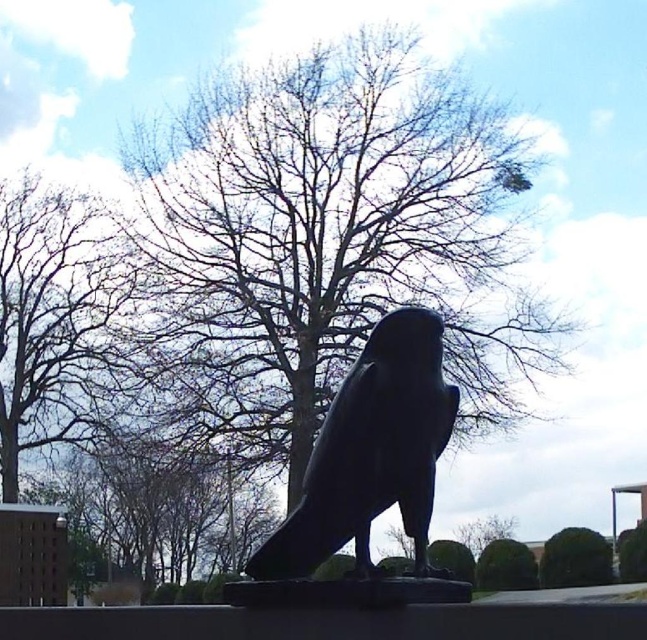
Does bare branches at center have a greater width compared to bare branches at upper left?

Indeed, bare branches at center has a greater width compared to bare branches at upper left.

Where is `bare branches at center`? The width and height of the screenshot is (647, 640). bare branches at center is located at coordinates (329, 240).

Is shiny black bird at center taller than green leafy bush at lower center?

In fact, shiny black bird at center may be shorter than green leafy bush at lower center.

Looking at this image, does shiny black bird at center appear on the right side of green leafy bush at lower center?

Incorrect, shiny black bird at center is not on the right side of green leafy bush at lower center.

Does point (384, 356) come closer to viewer compared to point (562, 531)?

Yes, point (384, 356) is closer to viewer.

This screenshot has height=640, width=647. In order to click on shiny black bird at center in this screenshot , I will do `click(371, 452)`.

Is bare branches at upper left below shiny black bird at center?

No, bare branches at upper left is not below shiny black bird at center.

Does bare branches at upper left have a greater height compared to shiny black bird at center?

Correct, bare branches at upper left is much taller as shiny black bird at center.

Which is behind, point (52, 369) or point (373, 444)?

Positioned behind is point (52, 369).

This screenshot has width=647, height=640. I want to click on bare branches at upper left, so click(58, 317).